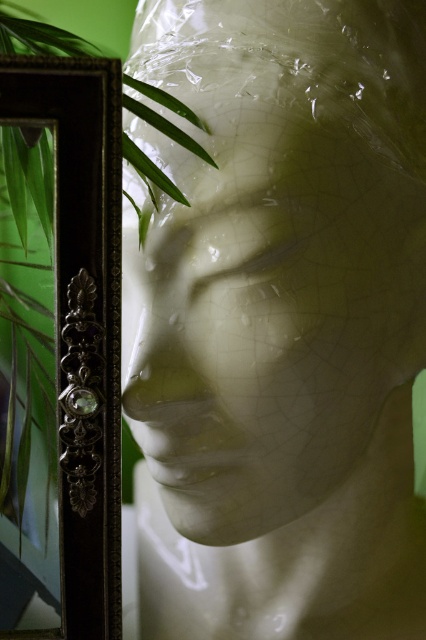
Who is positioned more to the right, dark brown wood picture frame at left or green leafy plant at left?

dark brown wood picture frame at left

Is dark brown wood picture frame at left below green leafy plant at left?

Indeed, dark brown wood picture frame at left is positioned under green leafy plant at left.

Locate an element on the screen. dark brown wood picture frame at left is located at coordinates (81, 323).

This screenshot has height=640, width=426. Find the location of `dark brown wood picture frame at left`. dark brown wood picture frame at left is located at coordinates coord(81,323).

Between white matte sculpture at center and green leafy plant at left, which one is positioned lower?

white matte sculpture at center is lower down.

Consider the image. Is white matte sculpture at center below green leafy plant at left?

Correct, white matte sculpture at center is located below green leafy plant at left.

Where is `white matte sculpture at center`? Image resolution: width=426 pixels, height=640 pixels. white matte sculpture at center is located at coordinates (273, 314).

How much distance is there between white matte sculpture at center and dark brown wood picture frame at left?

white matte sculpture at center and dark brown wood picture frame at left are 6.11 inches apart.

Who is lower down, white matte sculpture at center or dark brown wood picture frame at left?

Positioned lower is dark brown wood picture frame at left.

Between point (342, 372) and point (74, 182), which one is positioned in front?

Point (74, 182) is in front.

The image size is (426, 640). In order to click on white matte sculpture at center in this screenshot , I will do pyautogui.click(x=273, y=314).